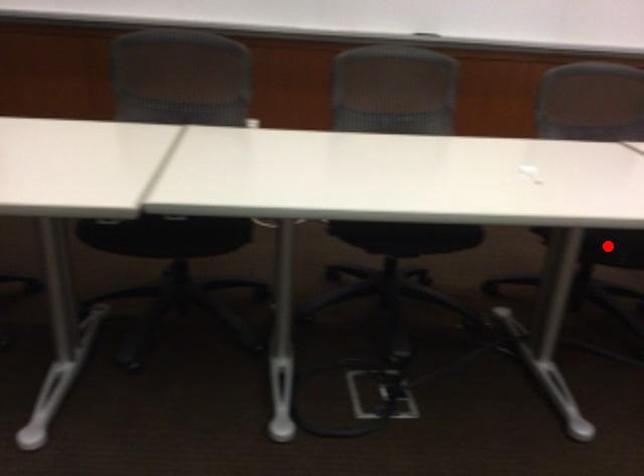
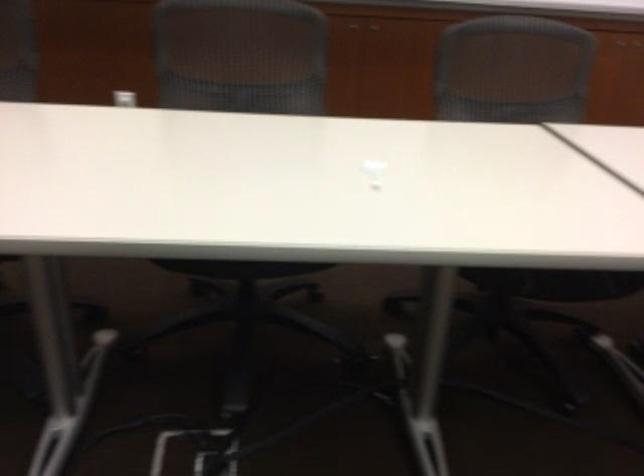
Question: I am providing you with two images of the same scene from different viewpoints. A red point is marked on the first image. Is the red point's position out of view in image 2?

Choices:
 (A) Yes
 (B) No

Answer: (A)